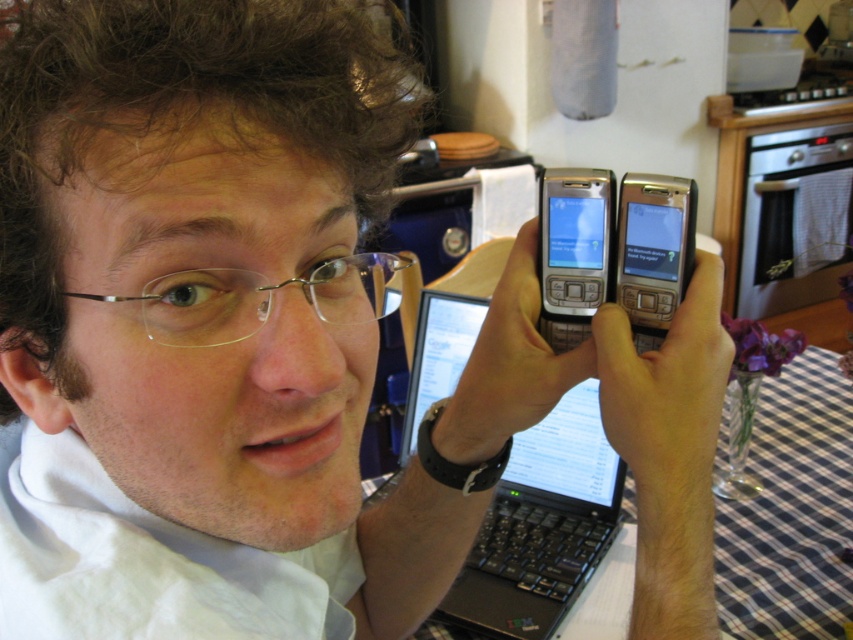
Is point (387, 288) farther from camera compared to point (567, 170)?

No, it is not.

Which is in front, point (321, 276) or point (540, 253)?

Point (321, 276) is more forward.

You are a GUI agent. You are given a task and a screenshot of the screen. Output one action in this format:
    pyautogui.click(x=<x>, y=<y>)
    Task: Click on the clear plastic glasses at center
    Image resolution: width=853 pixels, height=640 pixels.
    Given the screenshot: What is the action you would take?
    pyautogui.click(x=259, y=298)

Is clear plastic glasses at center positioned at the back of silver metallic smartphone at center?

No, it is not.

Can you confirm if clear plastic glasses at center is positioned to the right of silver metallic smartphone at center?

No, clear plastic glasses at center is not to the right of silver metallic smartphone at center.

Is point (328, 280) farther from viewer compared to point (657, 285)?

No, (328, 280) is in front of (657, 285).

What are the coordinates of `clear plastic glasses at center` in the screenshot? It's located at (259, 298).

Which is more to the left, black plastic laptop at center or silver metallic smartphone at center?

black plastic laptop at center

Can you confirm if black plastic laptop at center is smaller than silver metallic smartphone at center?

Incorrect, black plastic laptop at center is not smaller in size than silver metallic smartphone at center.

What do you see at coordinates (541, 525) in the screenshot?
I see `black plastic laptop at center` at bounding box center [541, 525].

The image size is (853, 640). In order to click on black plastic laptop at center in this screenshot , I will do `click(541, 525)`.